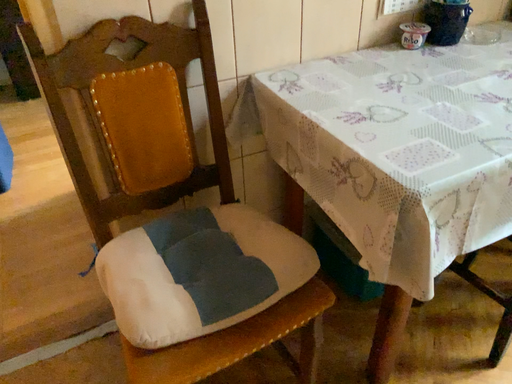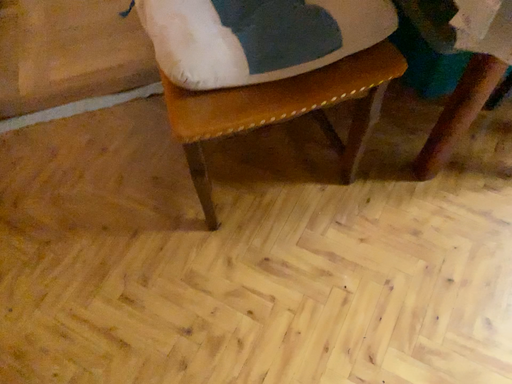
Question: Which way did the camera rotate in the video?

Choices:
 (A) rotated left
 (B) rotated right

Answer: (A)